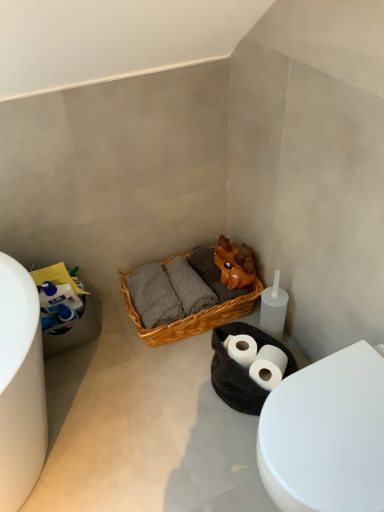
This screenshot has width=384, height=512. Identify the location of vacant area that is in front of woven wood picnic basket at center. (168, 396).